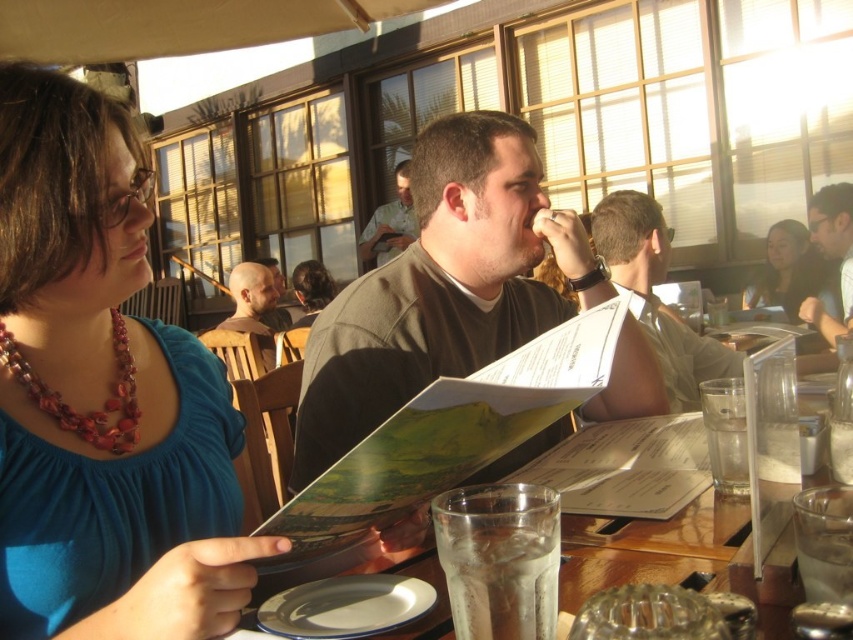
Does point (824, 273) come farther from viewer compared to point (846, 317)?

Yes, point (824, 273) is farther from viewer.

The height and width of the screenshot is (640, 853). Describe the element at coordinates (791, 273) in the screenshot. I see `matte black hair at upper right` at that location.

Where is `matte black hair at upper right`? Image resolution: width=853 pixels, height=640 pixels. matte black hair at upper right is located at coordinates (791, 273).

Can you confirm if matte coral necklace at center is wider than matte black hair at upper right?

No.

What do you see at coordinates (103, 396) in the screenshot? This screenshot has height=640, width=853. I see `matte coral necklace at center` at bounding box center [103, 396].

This screenshot has width=853, height=640. Find the location of `matte coral necklace at center`. matte coral necklace at center is located at coordinates [103, 396].

Is light brown shirt at center to the right of dark brown hair at center from the viewer's perspective?

Yes, light brown shirt at center is to the right of dark brown hair at center.

Between point (383, 218) and point (293, 324), which one is positioned in front?

Point (293, 324) is in front.

Between point (379, 253) and point (320, 269), which one is positioned behind?

Point (379, 253)

The width and height of the screenshot is (853, 640). What are the coordinates of `light brown shirt at center` in the screenshot? It's located at (390, 221).